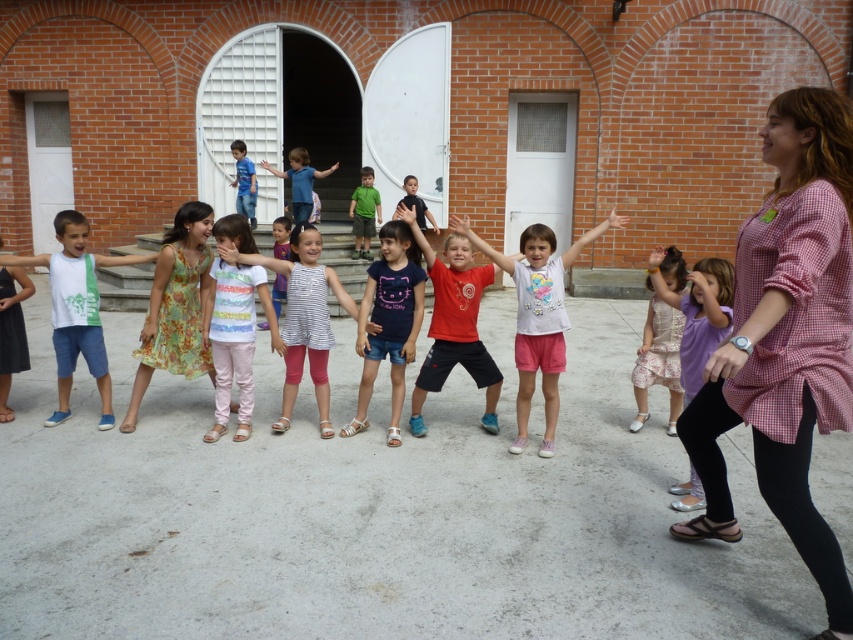
You are a photographer trying to capture both the striped cotton shirt at center and the striped fabric dress at center in a single frame. Given their sizes, which one would you need to position closer to the camera to ensure they appear roughly the same size in the photo?

The striped cotton shirt at center has a smaller size compared to the striped fabric dress at center. To make them appear the same size in the photo, you should position the striped cotton shirt at center closer to the camera than the striped fabric dress at center.

You are standing at point (347, 294) and want to move to point (100, 355). Is the path between these two points clear? Please explain your reasoning based on the scene description.

Point (100, 355) is in front of point (347, 294). Since the scene describes a courtyard with children and an adult engaged in an activity on a concrete surface, there are no obstacles mentioned between the two points. Therefore, the path is likely clear.

You are standing in the courtyard and want to walk from point (259, 291) to point (312, 243). Which direction should you face to move towards the latter?

You should face towards the lower right direction because point (312, 243) is located lower and to the right compared to point (259, 291).